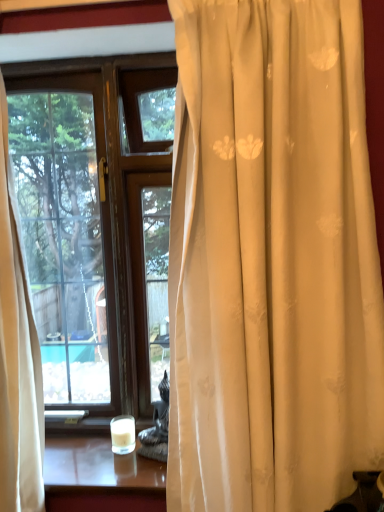
Find the location of a particular element. The height and width of the screenshot is (512, 384). free space in front of white glass candle at lower center is located at coordinates (118, 471).